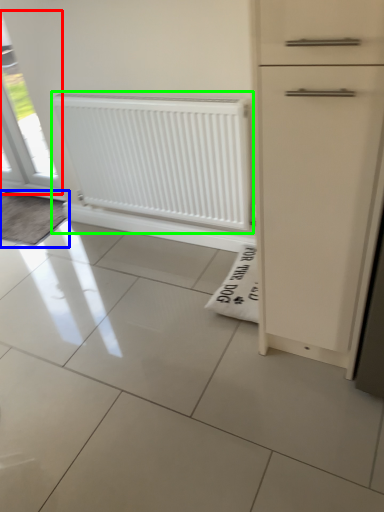
Question: Considering the real-world distances, which object is farthest from window (highlighted by a red box)? doormat (highlighted by a blue box) or radiator (highlighted by a green box)?

Choices:
 (A) doormat
 (B) radiator

Answer: (B)